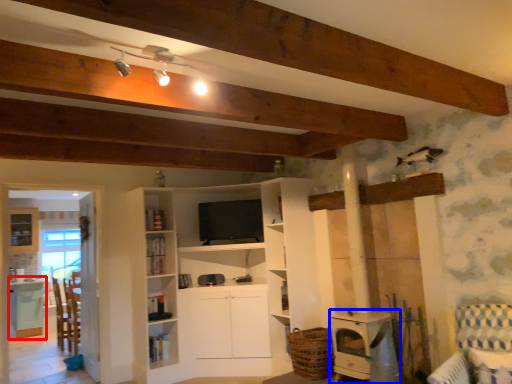
Question: Which object appears farthest to the camera in this image, table (highlighted by a red box) or appliance (highlighted by a blue box)?

Choices:
 (A) table
 (B) appliance

Answer: (A)